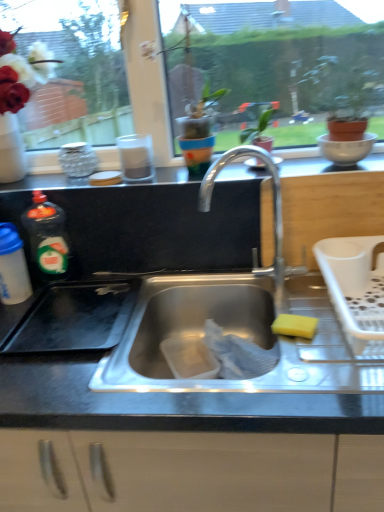
Locate an element on the screen. green matte plant at upper right is located at coordinates (342, 95).

Describe the element at coordinates (342, 95) in the screenshot. Image resolution: width=384 pixels, height=512 pixels. I see `green matte plant at upper right` at that location.

What are the coordinates of `polished metal faucet at center` in the screenshot? It's located at (273, 199).

What's the angular difference between transparent glass window screen at upper center and polished metal faucet at center's facing directions?

transparent glass window screen at upper center and polished metal faucet at center are facing 0.148 degrees away from each other.

Is transparent glass window screen at upper center not close to polished metal faucet at center?

That's not correct — transparent glass window screen at upper center is a little close to polished metal faucet at center.

Where is `tap that is on the right side of transparent glass window screen at upper center`? Image resolution: width=384 pixels, height=512 pixels. tap that is on the right side of transparent glass window screen at upper center is located at coordinates (273, 199).

From a real-world perspective, is black matte counter top at upper center on yellow sponge at sink right?

Yes, from a real-world perspective, black matte counter top at upper center is over yellow sponge at sink right

Can you confirm if black matte counter top at upper center is wider than yellow sponge at sink right?

Correct, the width of black matte counter top at upper center exceeds that of yellow sponge at sink right.

Is black matte counter top at upper center positioned before yellow sponge at sink right?

No, black matte counter top at upper center is further to the viewer.

Considering the relative sizes of black matte counter top at upper center and yellow sponge at sink right in the image provided, is black matte counter top at upper center bigger than yellow sponge at sink right?

Indeed, black matte counter top at upper center has a larger size compared to yellow sponge at sink right.

Is black matte counter top at upper center oriented away from polished metal faucet at center?

No, black matte counter top at upper center is not facing away from polished metal faucet at center.

Considering the relative sizes of black matte counter top at upper center and polished metal faucet at center in the image provided, is black matte counter top at upper center thinner than polished metal faucet at center?

No.

Is black matte counter top at upper center far from polished metal faucet at center?

No, black matte counter top at upper center is not far from polished metal faucet at center.

Which is in front, point (157, 177) or point (273, 271)?

The point (273, 271) is closer.

Based on the photo, in terms of width, does yellow sponge at sink right look wider or thinner when compared to transparent glass window screen at upper center?

Considering their sizes, yellow sponge at sink right looks broader than transparent glass window screen at upper center.

Could transparent glass window screen at upper center be considered to be inside yellow sponge at sink right?

Actually, transparent glass window screen at upper center is outside yellow sponge at sink right.

The width and height of the screenshot is (384, 512). I want to click on food in front of the transparent glass window screen at upper center, so click(295, 325).

Looking at the image, does translucent plastic bottle at left, placed as the 1th bottle when sorted from right to left, seem bigger or smaller compared to white plastic dish rack at right?

translucent plastic bottle at left, placed as the 1th bottle when sorted from right to left, is smaller than white plastic dish rack at right.

Can you tell me how much translucent plastic bottle at left, arranged as the 2th bottle when viewed from the left, and white plastic dish rack at right differ in facing direction?

The facing directions of translucent plastic bottle at left, arranged as the 2th bottle when viewed from the left, and white plastic dish rack at right are 1.05 degrees apart.

In the scene shown: Is translucent plastic bottle at left, arranged as the 2th bottle when viewed from the left, facing away from white plastic dish rack at right?

No, translucent plastic bottle at left, arranged as the 2th bottle when viewed from the left, is not facing away from white plastic dish rack at right.

From a real-world perspective, between white plastic dish rack at right and green matte plant at upper right, who is vertically higher?

green matte plant at upper right, from a real-world perspective.

From the image's perspective, who appears lower, white plastic dish rack at right or green matte plant at upper right?

white plastic dish rack at right appears lower in the image.

From their relative heights in the image, would you say white plastic dish rack at right is taller or shorter than green matte plant at upper right?

In the image, white plastic dish rack at right appears to be shorter than green matte plant at upper right.

Locate an element on the screen. The height and width of the screenshot is (512, 384). houseplant that is above the white plastic dish rack at right (from a real-world perspective) is located at coordinates 342,95.

Which point is more forward, (352,121) or (381,283)?

Positioned in front is point (381,283).

Which of these two, green matte plant at upper right or white plastic dish rack at right, stands shorter?

Standing shorter between the two is white plastic dish rack at right.

From the image's perspective, between green matte plant at upper right and white plastic dish rack at right, who is located below?

white plastic dish rack at right appears lower in the image.

Identify the location of tap in front of the transparent glass window screen at upper center. This screenshot has height=512, width=384. (273, 199).

What are the coordinates of `food that is below the black matte counter top at upper center (from the image's perspective)` in the screenshot? It's located at (295, 325).

When comparing their distances from translucent plastic bottle at left, placed as the 1th bottle when sorted from right to left, does polished metal faucet at center or translucent plastic bottle at left, marked as the first bottle in a left-to-right arrangement, seem further?

polished metal faucet at center is positioned further to the anchor translucent plastic bottle at left, placed as the 1th bottle when sorted from right to left.

From the image, which object appears to be farther from translucent plastic bottle at left, arranged as the 2th bottle when viewed from the left, green matte plant at upper right or translucent plastic bottle at left, marked as the first bottle in a left-to-right arrangement?

green matte plant at upper right.

From the image, which object appears to be farther from black matte counter top at upper center, yellow sponge at sink right or translucent plastic bottle at left, arranged as the 2th bottle when viewed from the left?

The object further to black matte counter top at upper center is yellow sponge at sink right.

Consider the image. From the image, which object appears to be nearer to white plastic dish rack at right, yellow sponge at sink right or black matte counter top at upper center?

The object closer to white plastic dish rack at right is yellow sponge at sink right.

Estimate the real-world distances between objects in this image. Which object is further from white glossy bowl at upper right, white plastic dish rack at right or polished metal faucet at center?

Based on the image, white plastic dish rack at right appears to be further to white glossy bowl at upper right.

From the image, which object appears to be farther from black matte counter top at upper center, translucent plastic bottle at left, placed as the 1th bottle when sorted from right to left, or white glossy bowl at upper right?

translucent plastic bottle at left, placed as the 1th bottle when sorted from right to left, is further to black matte counter top at upper center.

From the image, which object appears to be farther from polished metal faucet at center, translucent plastic bottle at left, marked as the first bottle in a left-to-right arrangement, or black matte counter top at upper center?

Based on the image, translucent plastic bottle at left, marked as the first bottle in a left-to-right arrangement, appears to be further to polished metal faucet at center.

When comparing their distances from transparent glass window screen at upper center, does white plastic dish rack at right or black matte counter top at upper center seem further?

white plastic dish rack at right is positioned further to the anchor transparent glass window screen at upper center.

Where is `tap between green matte plant at upper right and yellow sponge at sink right in the up-down direction`? Image resolution: width=384 pixels, height=512 pixels. tap between green matte plant at upper right and yellow sponge at sink right in the up-down direction is located at coordinates (273, 199).

Image resolution: width=384 pixels, height=512 pixels. I want to click on food located between translucent plastic bottle at left, arranged as the 2th bottle when viewed from the left, and white plastic dish rack at right in the left-right direction, so click(x=295, y=325).

Where is `tap between translucent plastic bottle at left, placed as the 1th bottle when sorted from right to left, and white plastic dish rack at right`? tap between translucent plastic bottle at left, placed as the 1th bottle when sorted from right to left, and white plastic dish rack at right is located at coordinates (273, 199).

I want to click on tap situated between translucent plastic bottle at left, arranged as the 2th bottle when viewed from the left, and yellow sponge at sink right from left to right, so click(x=273, y=199).